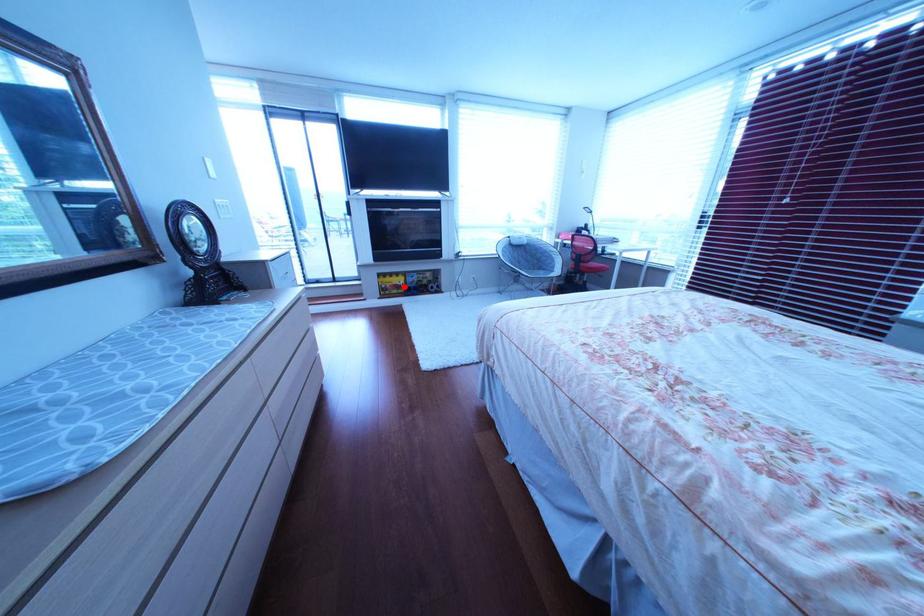
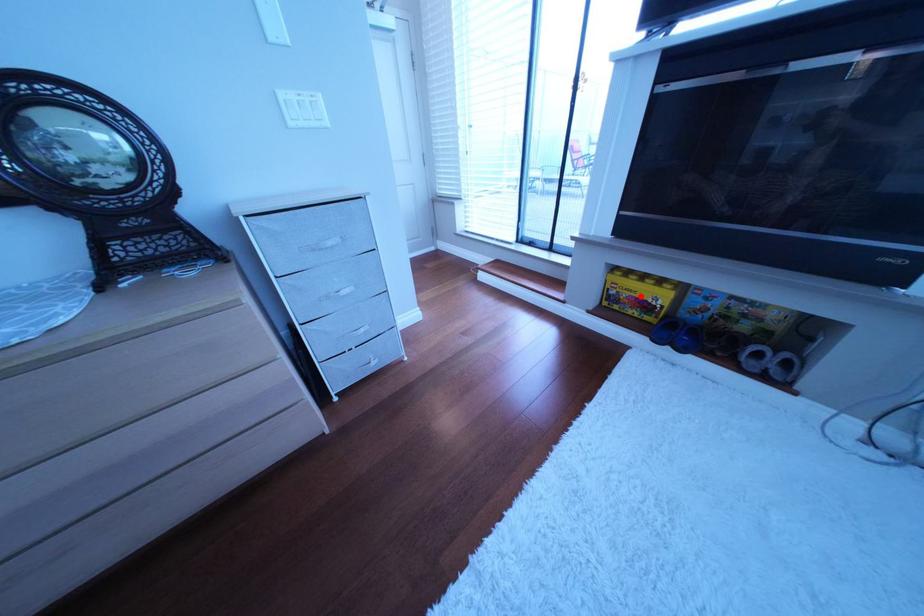
I am providing you with two images of the same scene from different viewpoints. A red point is marked on the first image and another point is marked on the second image. Are the points marked in image1 and image2 representing the same 3D position?

Yes